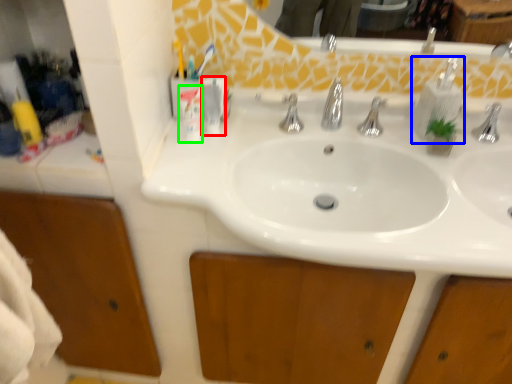
Question: Considering the real-world distances, which object is closest to toiletry (highlighted by a red box)? soap dispenser (highlighted by a blue box) or toiletry (highlighted by a green box).

Choices:
 (A) soap dispenser
 (B) toiletry

Answer: (B)